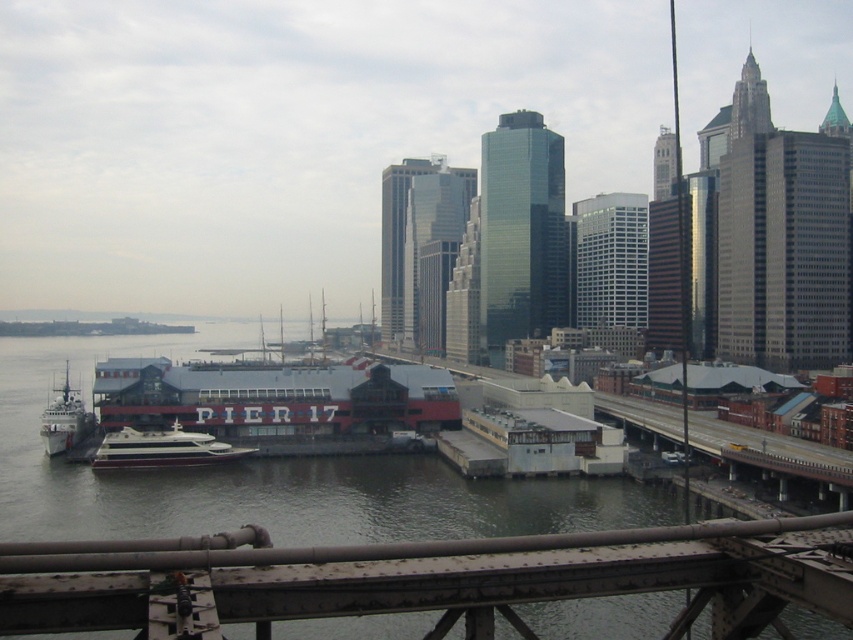
Question: Which is farther from the greenish-gray water at center?

Choices:
 (A) shiny white yacht at center
 (B) metallic gray ship at lower left

Answer: (B)

Question: Estimate the real-world distances between objects in this image. Which object is farther from the greenish-gray water at center?

Choices:
 (A) metallic gray ship at lower left
 (B) shiny white yacht at center
 (C) rusty metal bridge at lower center

Answer: (C)

Question: Is greenish-gray water at center wider than metallic gray ship at lower left?

Choices:
 (A) yes
 (B) no

Answer: (A)

Question: Which of the following is the closest to the observer?

Choices:
 (A) rusty metal bridge at lower center
 (B) shiny white yacht at center
 (C) metallic gray ship at lower left
 (D) greenish-gray water at center

Answer: (A)

Question: Is rusty metal bridge at lower center to the right of metallic gray ship at lower left from the viewer's perspective?

Choices:
 (A) no
 (B) yes

Answer: (B)

Question: Is rusty metal bridge at lower center above shiny white yacht at center?

Choices:
 (A) yes
 (B) no

Answer: (B)